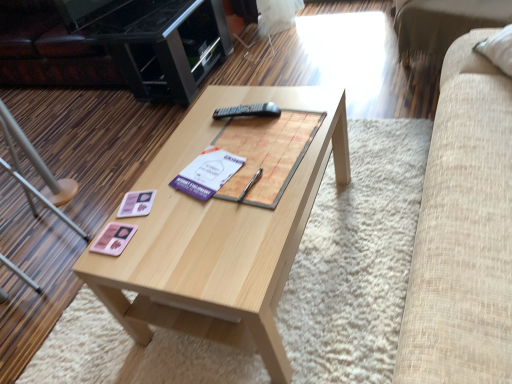
This screenshot has height=384, width=512. I want to click on free space in front of white paper at center, so click(x=211, y=218).